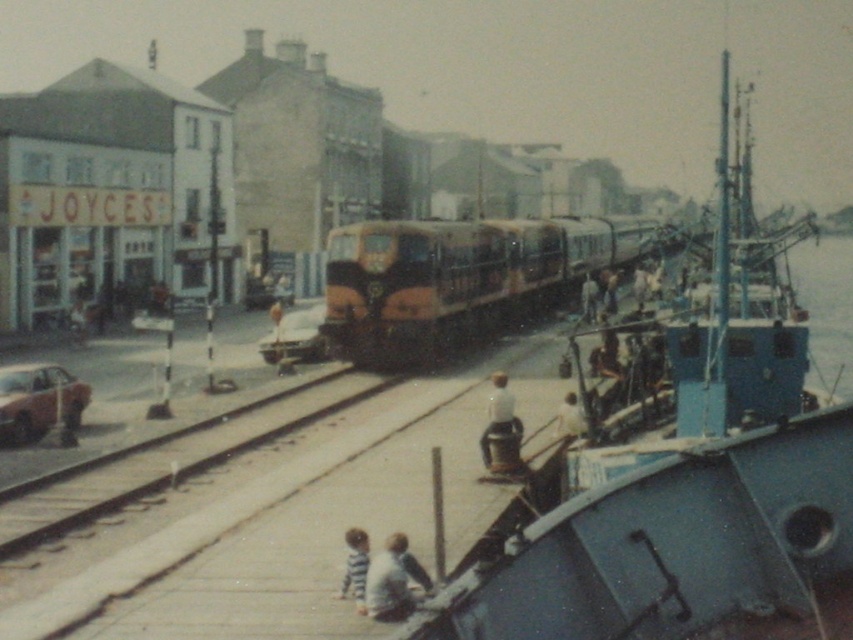
You are a delivery person who needs to move a package from the blue metallic boat at center to the smooth concrete train track at center. What should you do first?

The blue metallic boat at center is above the smooth concrete train track at center, so you should first lower the blue metallic boat at center to access the smooth concrete train track at center.

You are standing at the point with coordinates point [566,404] and want to walk to the point with coordinates point [352,580]. Which direction should you move relative to the ship in the foreground?

You should move forward relative to the ship in the foreground because point [352,580] is in front of point [566,404].

Looking at this image, you are a photographer trying to capture a clear shot of the striped fabric child at lower center and the white fabric shirt at lower center. Since you want both subjects to be in focus, which one should you focus on first to ensure the other remains sharp?

You should focus on the striped fabric child at lower center first because it is closer to the camera than the white fabric shirt at lower center, ensuring the background subject stays in focus.